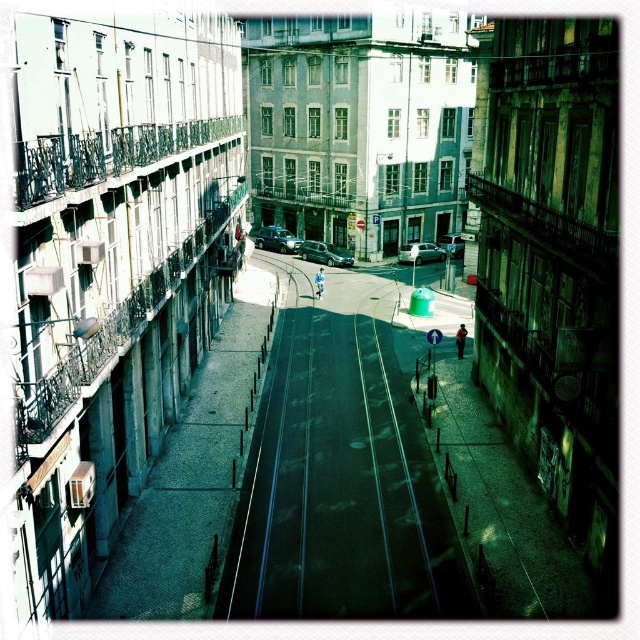
You are standing on the balcony overlooking the street and want to take a photo of the shiny silver sedan at center. If the tram track runs down the center of the street, where should you position your camera to ensure the sedan is centered in your shot?

The shiny silver sedan at center is already positioned at the center of the street, so aligning your camera directly towards the center of the tram track will ensure the sedan is centered in your photo.